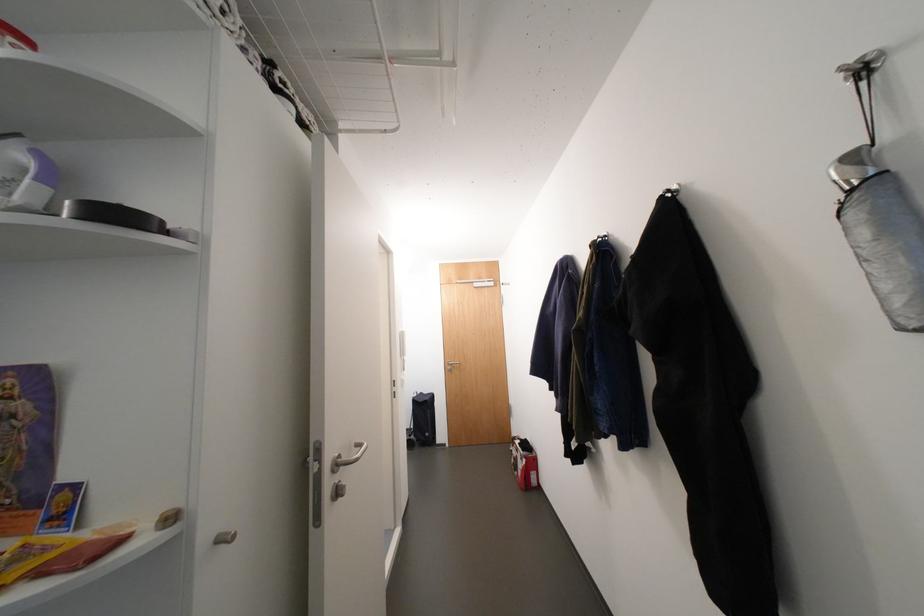
Image resolution: width=924 pixels, height=616 pixels. In order to click on white door handle in this screenshot , I will do click(347, 456).